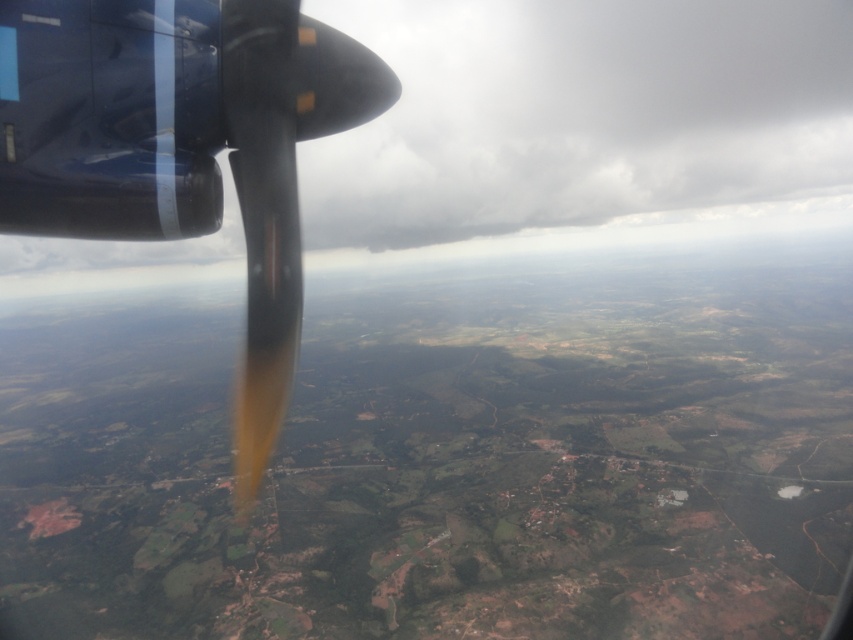
You are a passenger on an aircraft and want to know what object is located at the point with coordinates (583, 120). Can you identify it?

The point at coordinates (583, 120) corresponds to the matte black propeller at upper left.

You are a pilot flying an aircraft and notice two propellers at the upper left of your window. You need to determine if both propellers are within a safe distance of 1000 meters from each other to avoid collision. Based on the scene, can you confirm if the distance between the matte black propeller at upper left and the shiny metallic propeller at upper left is within the safe limit?

The distance between the matte black propeller at upper left and the shiny metallic propeller at upper left is 676.92 meters, which is within the safe limit of 1000 meters. Therefore, there is no risk of collision between the two propellers.

You are a passenger on the aircraft and want to know which of the two points, point (709, 125) or point (129, 150), is closer to the propeller blades. Based on their positions, which point is closer?

Point (129, 150) is closer to the propeller blades because it is in front of point (709, 125), which is behind it.